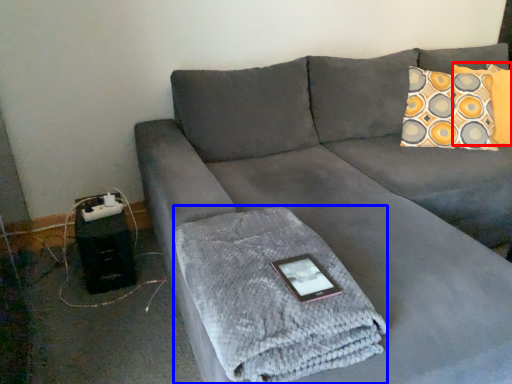
Question: Among these objects, which one is nearest to the camera, pillow (highlighted by a red box) or bath towel (highlighted by a blue box)?

Choices:
 (A) pillow
 (B) bath towel

Answer: (B)